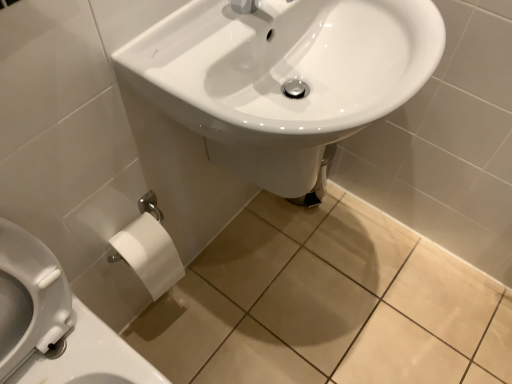
Question: From a real-world perspective, is white paper at lower left located higher than white glossy sink at center?

Choices:
 (A) no
 (B) yes

Answer: (A)

Question: Are white paper at lower left and white glossy sink at center far apart?

Choices:
 (A) no
 (B) yes

Answer: (A)

Question: Is white paper at lower left oriented towards white glossy sink at center?

Choices:
 (A) yes
 (B) no

Answer: (B)

Question: Is white paper at lower left facing away from white glossy sink at center?

Choices:
 (A) yes
 (B) no

Answer: (B)

Question: Can you confirm if white paper at lower left is positioned to the left of white glossy sink at center?

Choices:
 (A) no
 (B) yes

Answer: (B)

Question: Choose the correct answer: Is white glossy sink at center inside white paper at lower left or outside it?

Choices:
 (A) outside
 (B) inside

Answer: (A)

Question: Considering the positions of white glossy sink at center and white paper at lower left in the image, is white glossy sink at center taller or shorter than white paper at lower left?

Choices:
 (A) short
 (B) tall

Answer: (A)

Question: Is white glossy sink at center wider or thinner than white paper at lower left?

Choices:
 (A) wide
 (B) thin

Answer: (B)

Question: From a real-world perspective, relative to white paper at lower left, is white glossy sink at center vertically above or below?

Choices:
 (A) below
 (B) above

Answer: (B)

Question: Does point (116, 236) appear closer or farther from the camera than point (1, 286)?

Choices:
 (A) farther
 (B) closer

Answer: (A)

Question: Looking at the image, does white matte toilet paper at lower left seem bigger or smaller compared to white paper at lower left?

Choices:
 (A) big
 (B) small

Answer: (B)

Question: Is white matte toilet paper at lower left wider or thinner than white paper at lower left?

Choices:
 (A) wide
 (B) thin

Answer: (B)

Question: From the image's perspective, relative to white paper at lower left, is white matte toilet paper at lower left above or below?

Choices:
 (A) below
 (B) above

Answer: (B)

Question: Which is correct: white paper at lower left is inside white glossy sink at center, or outside of it?

Choices:
 (A) inside
 (B) outside

Answer: (B)

Question: From a real-world perspective, is white paper at lower left positioned above or below white glossy sink at center?

Choices:
 (A) above
 (B) below

Answer: (B)